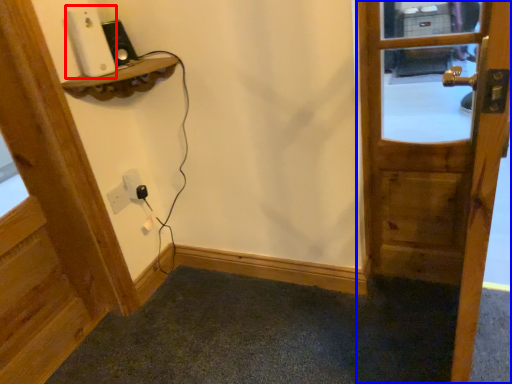
Question: Which object is further to the camera taking this photo, ipod (highlighted by a red box) or door (highlighted by a blue box)?

Choices:
 (A) ipod
 (B) door

Answer: (A)